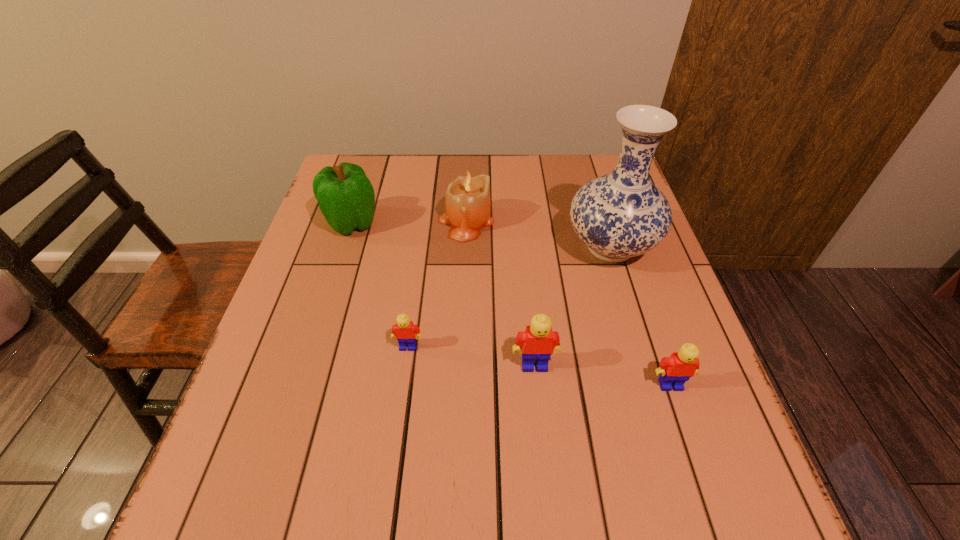
This screenshot has height=540, width=960. In order to click on free space that is in between the vase and the fifth tallest object in this screenshot , I will do `click(640, 316)`.

Image resolution: width=960 pixels, height=540 pixels. I want to click on free point between the nearest object and the leftmost object, so coord(511,303).

Locate an element on the screen. object that is the third closest one to the vase is located at coordinates (675, 370).

Locate an element on the screen. The height and width of the screenshot is (540, 960). object that is the fifth closest to the vase is located at coordinates (346, 198).

The height and width of the screenshot is (540, 960). I want to click on Lego that is the second closest one to the bell pepper, so click(x=539, y=341).

Image resolution: width=960 pixels, height=540 pixels. What are the coordinates of `Lego that is the second closest to the fourth object from left to right` in the screenshot? It's located at (404, 330).

Where is `free region that satisfies the following two spatial constraints: 1. on the front side of the leftmost object; 2. on the right side of the tallest object`? This screenshot has height=540, width=960. free region that satisfies the following two spatial constraints: 1. on the front side of the leftmost object; 2. on the right side of the tallest object is located at coordinates (344, 247).